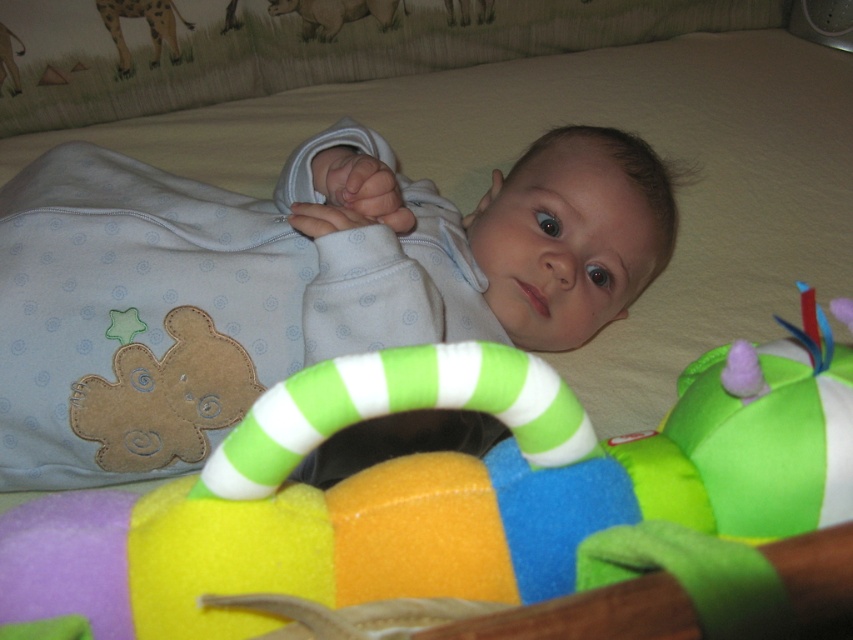
Question: Which object is positioned farthest from the spotted fur giraffe at upper left?

Choices:
 (A) brown textured elephant at upper center
 (B) matte white onesie at center

Answer: (B)

Question: Does matte white onesie at center have a greater width compared to spotted fur giraffe at upper left?

Choices:
 (A) no
 (B) yes

Answer: (B)

Question: Is spotted fur giraffe at upper left closer to the viewer compared to brown textured elephant at upper center?

Choices:
 (A) no
 (B) yes

Answer: (B)

Question: Does matte white onesie at center have a lesser width compared to spotted fur giraffe at upper left?

Choices:
 (A) no
 (B) yes

Answer: (A)

Question: Considering the real-world distances, which object is farthest from the spotted fur giraffe at upper left?

Choices:
 (A) matte white onesie at center
 (B) brown textured elephant at upper center

Answer: (A)

Question: Estimate the real-world distances between objects in this image. Which object is closer to the matte white onesie at center?

Choices:
 (A) spotted fur giraffe at upper left
 (B) brown textured elephant at upper center

Answer: (B)